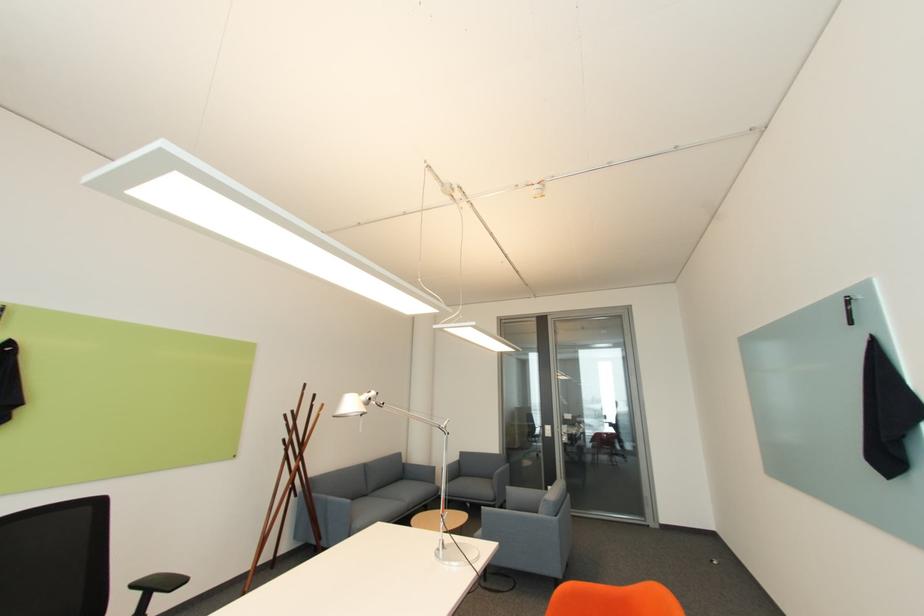
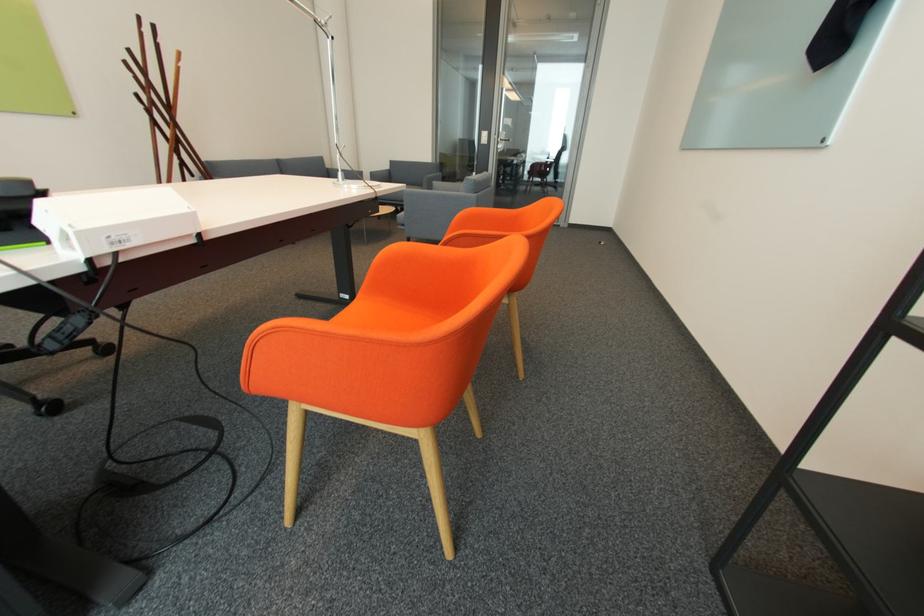
Question: The images are taken continuously from a first-person perspective. In which direction is your viewpoint rotating?

Choices:
 (A) Left
 (B) Right
 (C) Up
 (D) Down

Answer: (D)